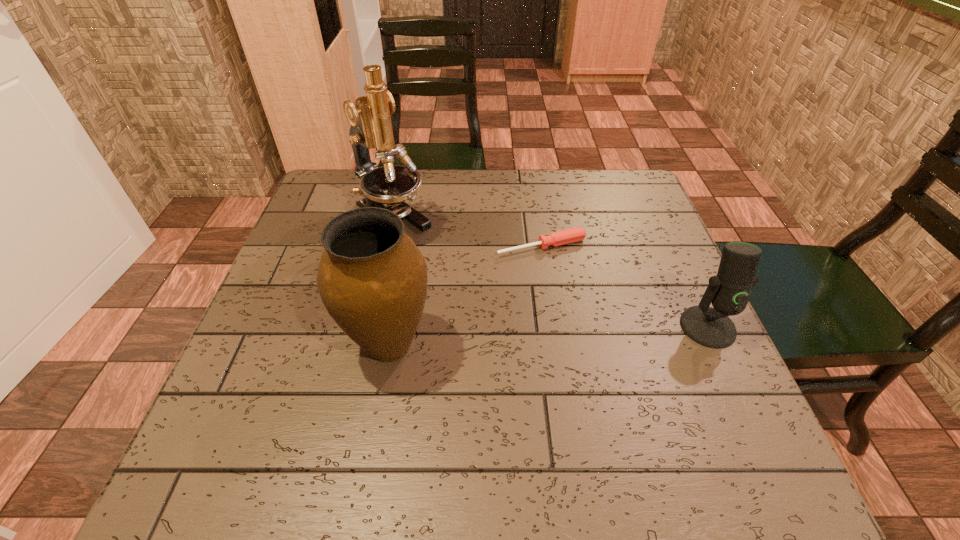
Identify the location of vacant space that is in between the urn and the microphone. (548, 336).

I want to click on empty location between the third shortest object and the second shortest object, so click(x=548, y=336).

Identify which object is the third nearest to the urn. Please provide its 2D coordinates. Your answer should be formatted as a tuple, i.e. [(x, y)], where the tuple contains the x and y coordinates of a point satisfying the conditions above.

[(728, 291)]

Locate an element on the screen. This screenshot has height=540, width=960. object that stands as the third closest to the tallest object is located at coordinates click(x=728, y=291).

Where is `vacant space that satisfies the following two spatial constraints: 1. on the front side of the second shortest object; 2. on the right side of the third object from left to right`? This screenshot has height=540, width=960. vacant space that satisfies the following two spatial constraints: 1. on the front side of the second shortest object; 2. on the right side of the third object from left to right is located at coordinates (554, 327).

The height and width of the screenshot is (540, 960). I want to click on free point that satisfies the following two spatial constraints: 1. on the back side of the urn; 2. on the right side of the rightmost object, so click(393, 327).

This screenshot has height=540, width=960. Find the location of `blank space that satisfies the following two spatial constraints: 1. on the back side of the microphone; 2. on the right side of the urn`. blank space that satisfies the following two spatial constraints: 1. on the back side of the microphone; 2. on the right side of the urn is located at coordinates (393, 327).